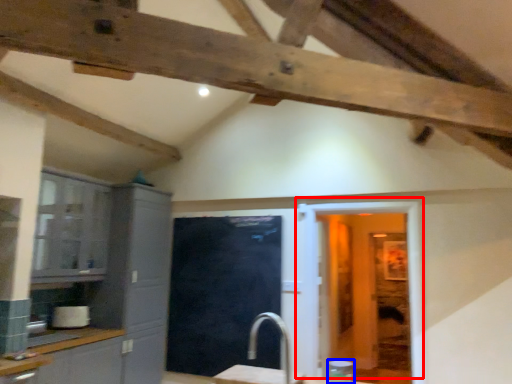
Question: Which object appears closest to the camera in this image, door (highlighted by a red box) or appliance (highlighted by a blue box)?

Choices:
 (A) door
 (B) appliance

Answer: (B)